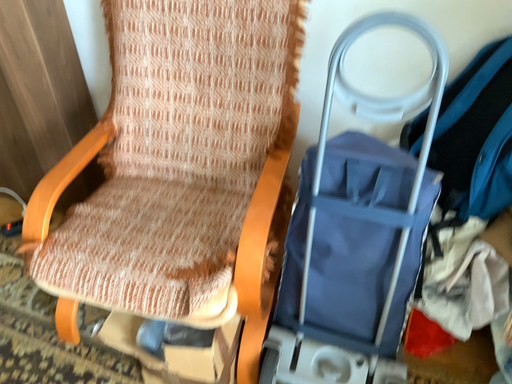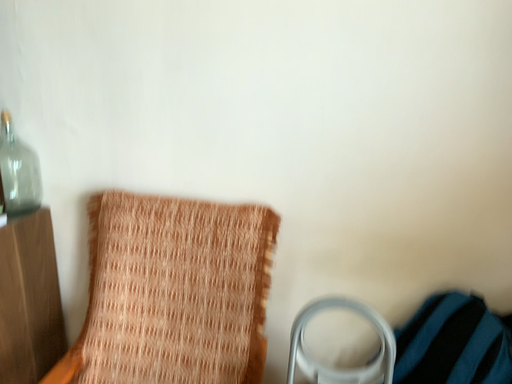
Question: Which way did the camera rotate in the video?

Choices:
 (A) rotated downward
 (B) rotated upward

Answer: (B)